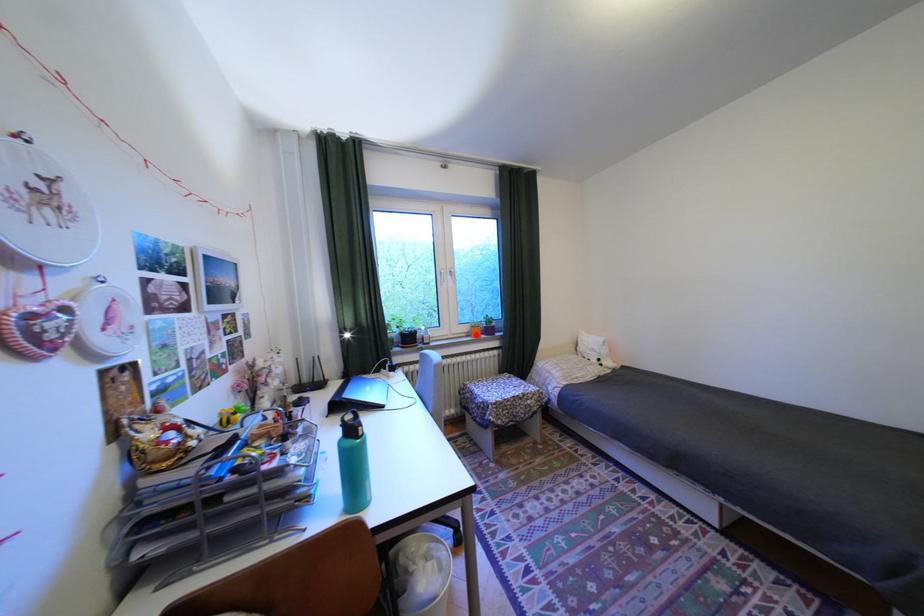
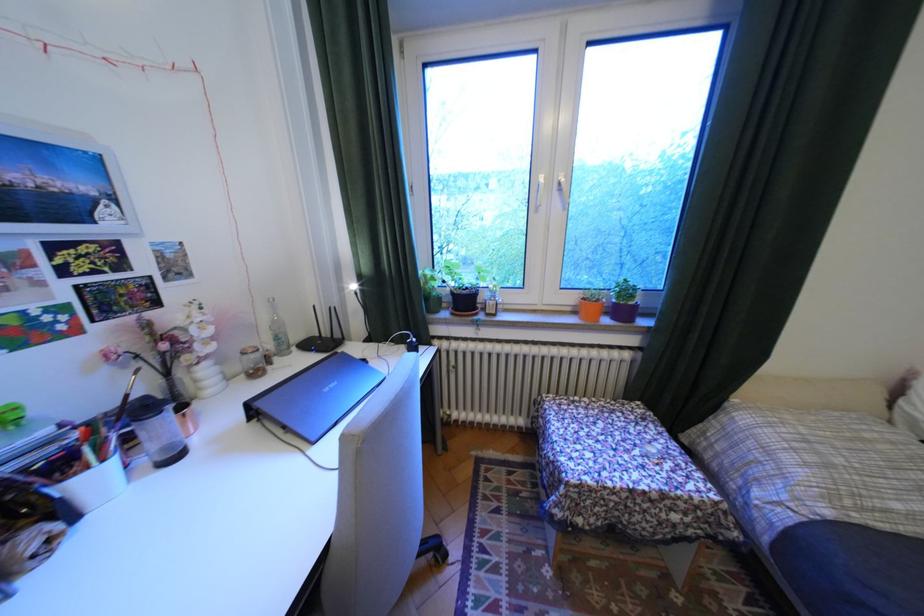
Question: I am providing you with two images of the same scene from different viewpoints. Given a red point in image1, look at the same physical point in image2. Is it:

Choices:
 (A) Closer to the viewpoint
 (B) Farther from the viewpoint

Answer: (A)